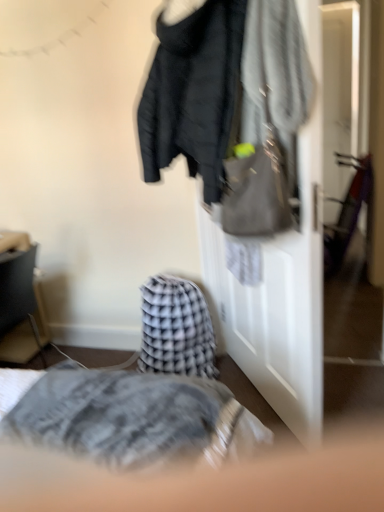
Question: From a real-world perspective, is matte black jacket at upper center under matte black jacket at center?

Choices:
 (A) yes
 (B) no

Answer: (B)

Question: Is matte black jacket at upper center in contact with matte black jacket at center?

Choices:
 (A) yes
 (B) no

Answer: (B)

Question: Is matte black jacket at upper center oriented away from matte black jacket at center?

Choices:
 (A) yes
 (B) no

Answer: (A)

Question: From a real-world perspective, is matte black jacket at upper center physically above matte black jacket at center?

Choices:
 (A) yes
 (B) no

Answer: (A)

Question: From the image's perspective, would you say matte black jacket at upper center is positioned over matte black jacket at center?

Choices:
 (A) no
 (B) yes

Answer: (B)

Question: Considering the positions of matte black jacket at upper center and matte black jacket at center in the image, is matte black jacket at upper center wider or thinner than matte black jacket at center?

Choices:
 (A) wide
 (B) thin

Answer: (A)

Question: From a real-world perspective, relative to matte black jacket at center, is matte black jacket at upper center vertically above or below?

Choices:
 (A) below
 (B) above

Answer: (B)

Question: Is matte black jacket at upper center inside or outside of matte black jacket at center?

Choices:
 (A) inside
 (B) outside

Answer: (B)

Question: From the image's perspective, relative to matte black jacket at center, is matte black jacket at upper center above or below?

Choices:
 (A) below
 (B) above

Answer: (B)

Question: Considering their positions, is matte black side table at left located in front of or behind matte black jacket at upper center?

Choices:
 (A) front
 (B) behind

Answer: (B)

Question: In terms of size, does matte black side table at left appear bigger or smaller than matte black jacket at upper center?

Choices:
 (A) small
 (B) big

Answer: (A)

Question: From their relative heights in the image, would you say matte black side table at left is taller or shorter than matte black jacket at upper center?

Choices:
 (A) tall
 (B) short

Answer: (A)

Question: Is matte black side table at left inside the boundaries of matte black jacket at upper center, or outside?

Choices:
 (A) inside
 (B) outside

Answer: (B)

Question: Considering the positions of matte black jacket at upper center and matte gray handbag at upper right in the image, is matte black jacket at upper center wider or thinner than matte gray handbag at upper right?

Choices:
 (A) wide
 (B) thin

Answer: (A)

Question: Considering their positions, is matte black jacket at upper center located in front of or behind matte gray handbag at upper right?

Choices:
 (A) front
 (B) behind

Answer: (B)